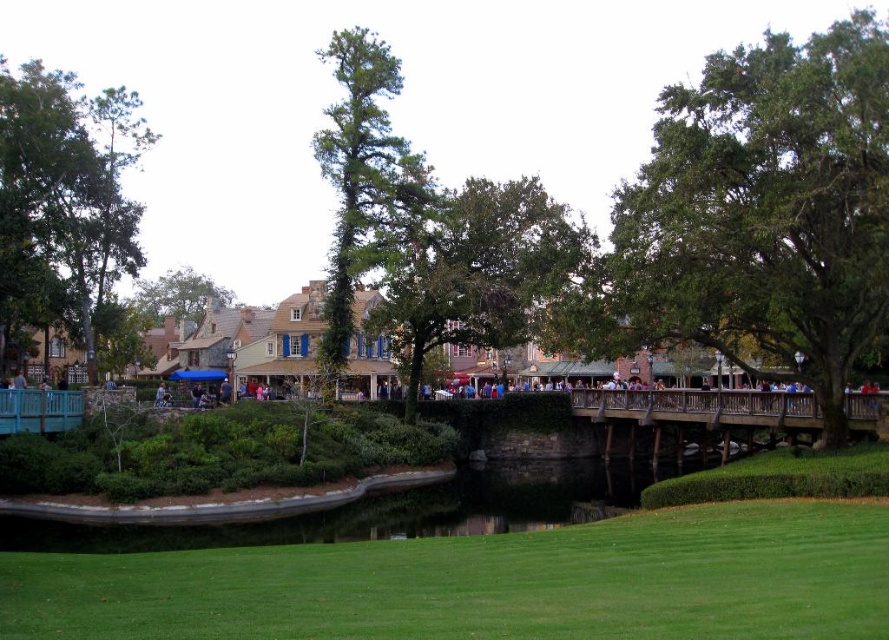
Based on the photo, you are standing at the edge of the green grass at lower center and want to walk to the wooden bridge at center. Which direction should you move to reach it?

Since the green grass at lower center is closer to the viewer than the wooden bridge at center, you should move forward away from the viewer to reach the wooden bridge at center.

You are standing at the wooden bridge at center and want to walk towards the green grass at lower center. Which direction should you face to move towards it?

You should face to the left to move towards the green grass at lower center since it is located to the left of the wooden bridge at center according to the description.